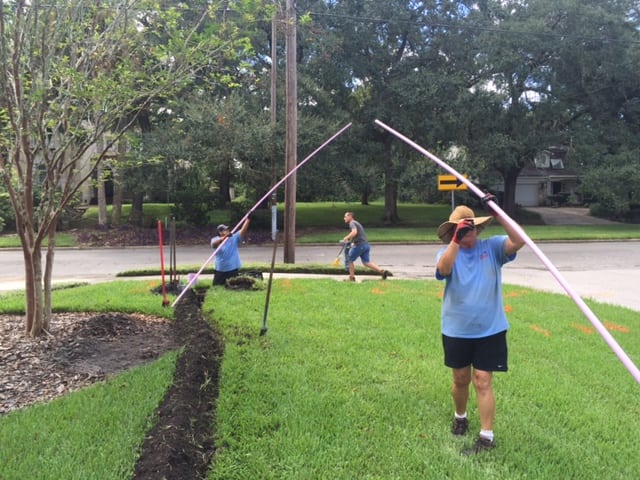
At what (x,y) coordinates should I click in order to perform the action: click on cable. Please return your answer as a coordinate pair (x, y). Image resolution: width=640 pixels, height=480 pixels. Looking at the image, I should click on [380, 22].